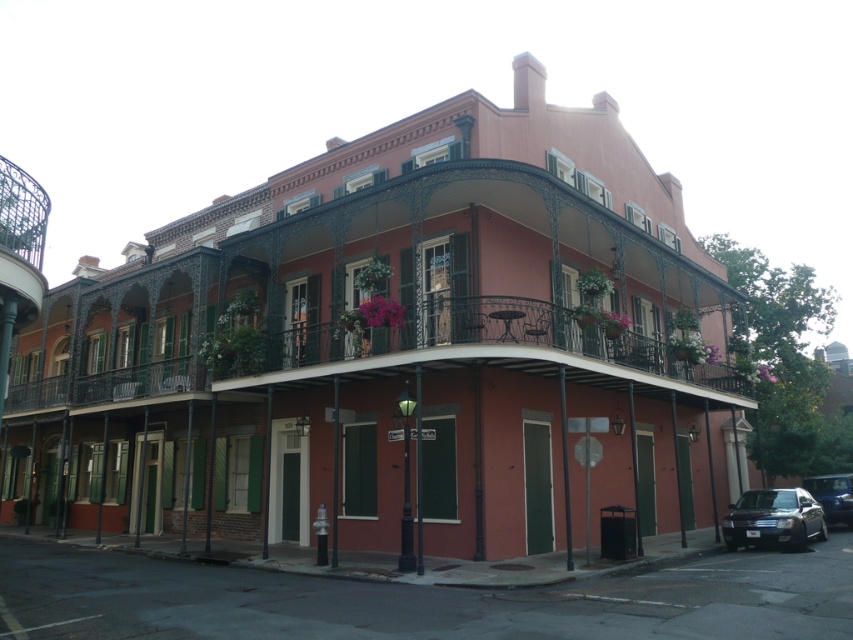
Question: Is shiny black sedan at lower right to the right of shiny blue sedan at lower right from the viewer's perspective?

Choices:
 (A) yes
 (B) no

Answer: (B)

Question: Observing the image, what is the correct spatial positioning of shiny black sedan at lower right in reference to shiny blue sedan at lower right?

Choices:
 (A) left
 (B) right

Answer: (A)

Question: Which point is closer to the camera taking this photo?

Choices:
 (A) pyautogui.click(x=822, y=531)
 (B) pyautogui.click(x=811, y=492)

Answer: (A)

Question: Does shiny black sedan at lower right have a larger size compared to shiny blue sedan at lower right?

Choices:
 (A) no
 (B) yes

Answer: (B)